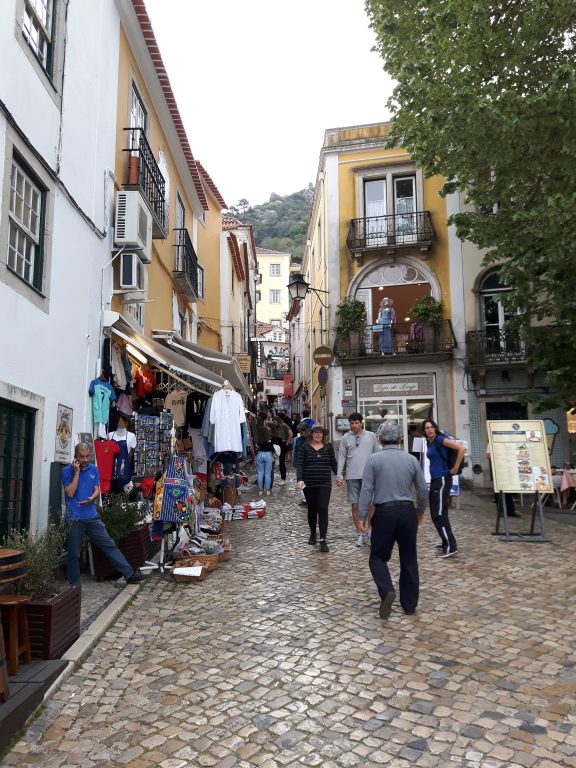
You are a GUI agent. You are given a task and a screenshot of the screen. Output one action in this format:
    pyautogui.click(x=<x>, y=<y>)
    Task: Click on the walk way
    
    Given the screenshot: What is the action you would take?
    pyautogui.click(x=291, y=700)